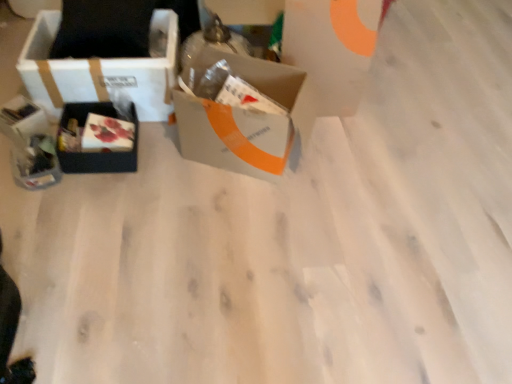
Image resolution: width=512 pixels, height=384 pixels. Identify the location of free space that is in between matte black gift box at left, which ranks as the first gift box in bottom-to-top order, and matte black gift box at left, which ranks as the second gift box in bottom-to-top order. (19, 156).